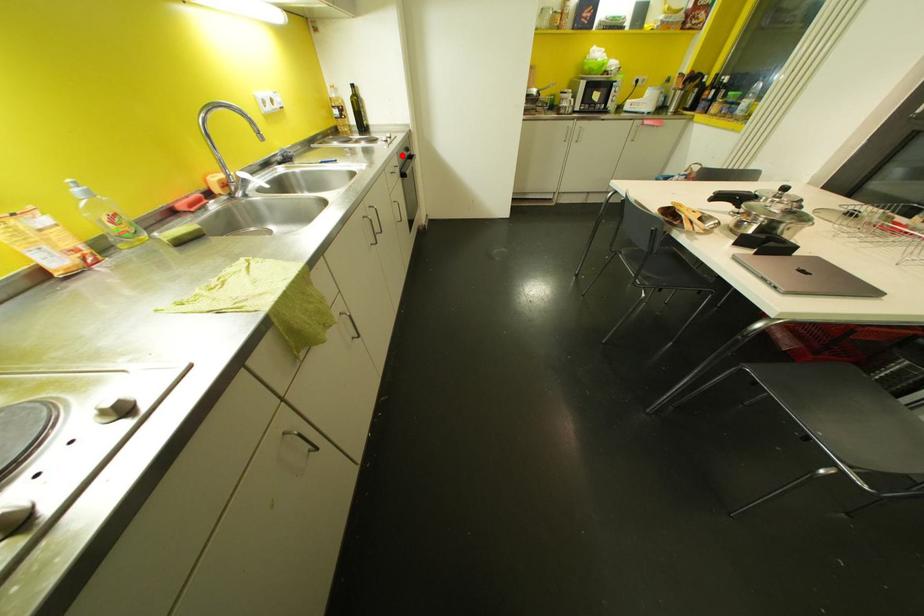
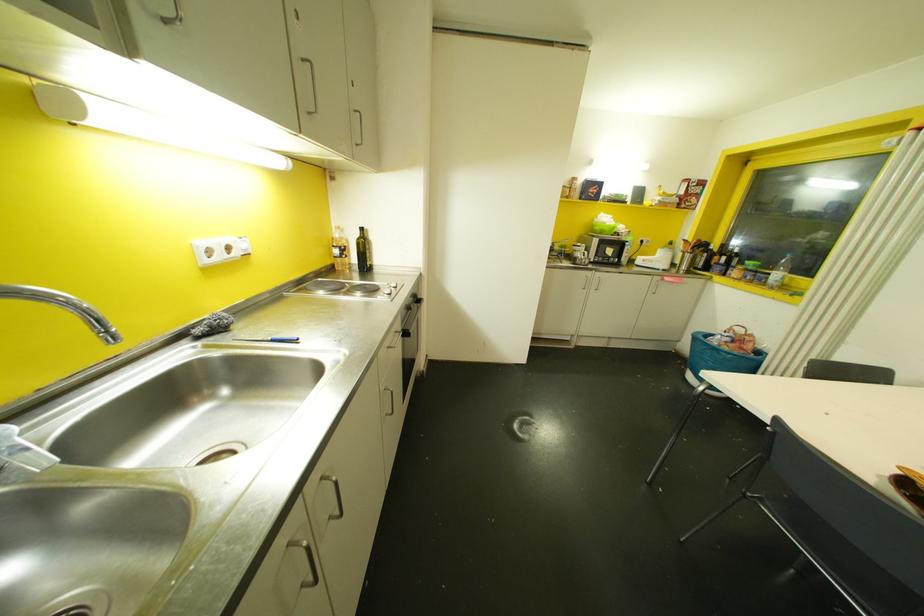
Find the pixel in the second image that matches the highlighted location in the first image.

(407, 307)